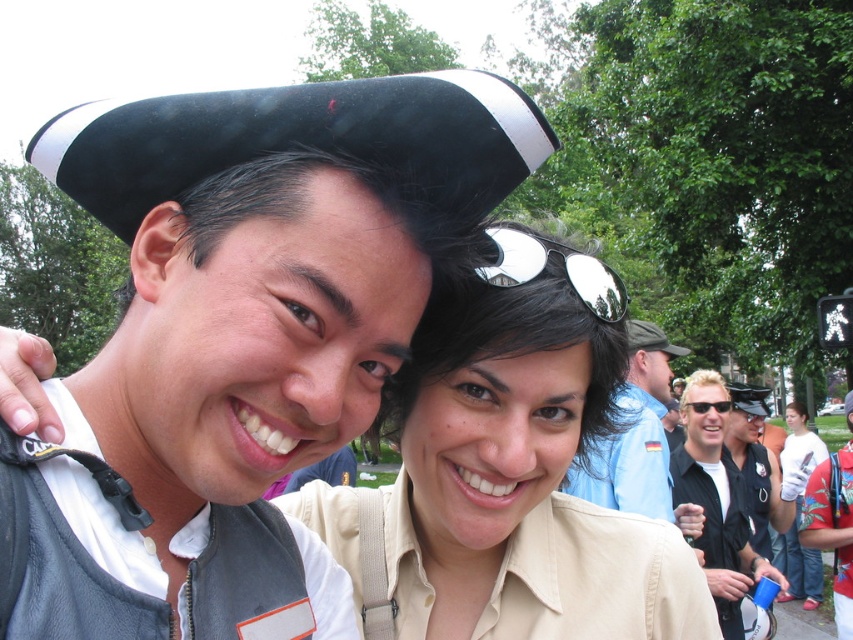
Question: Which of these objects is positioned farthest from the matte black hat at upper center?

Choices:
 (A) satin black cap at upper right
 (B) matte black hat at center
 (C) blue uniform shirt at center

Answer: (B)

Question: Where is matte black hat at center located in relation to light brown hair at center in the image?

Choices:
 (A) left
 (B) right

Answer: (A)

Question: From the image, what is the correct spatial relationship of light brown hair at center in relation to dark gray fabric cap at upper center?

Choices:
 (A) above
 (B) below

Answer: (A)

Question: Considering the real-world distances, which object is closest to the silver reflective sunglasses at center?

Choices:
 (A) blue uniform shirt at center
 (B) matte beige shirt at center

Answer: (B)

Question: Based on their relative distances, which object is nearer to the silver reflective sunglasses at center?

Choices:
 (A) dark gray fabric cap at upper center
 (B) matte black hat at upper center

Answer: (A)

Question: Does matte khaki shirt at center appear on the right side of matte beige shirt at center?

Choices:
 (A) no
 (B) yes

Answer: (A)